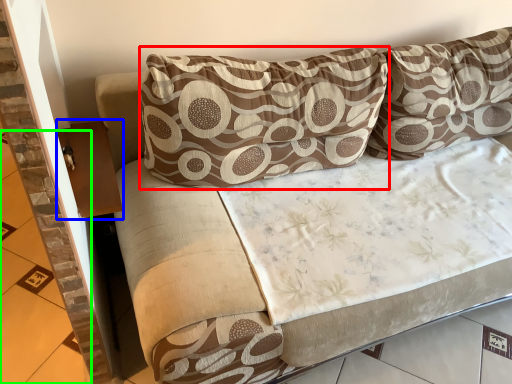
Question: Estimate the real-world distances between objects in this image. Which object is closer to pillow (highlighted by a red box), table (highlighted by a blue box) or tile (highlighted by a green box)?

Choices:
 (A) table
 (B) tile

Answer: (A)